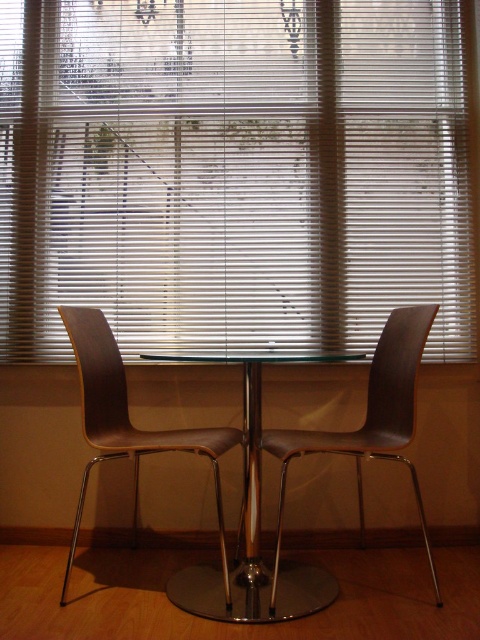
What do you see at coordinates (370, 419) in the screenshot? The width and height of the screenshot is (480, 640). I see `brown matte swivel chair at center` at bounding box center [370, 419].

What are the coordinates of `brown matte swivel chair at center` in the screenshot? It's located at (370, 419).

The width and height of the screenshot is (480, 640). I want to click on brown matte swivel chair at center, so click(370, 419).

Locate an element on the screen. This screenshot has height=640, width=480. brown matte swivel chair at center is located at coordinates (370, 419).

Is point (284, 262) positioned behind point (263, 600)?

That is True.

Identify the location of white matte blinds at center. (233, 173).

You are a GUI agent. You are given a task and a screenshot of the screen. Output one action in this format:
    pyautogui.click(x=<x>, y=<y>)
    Task: Click on the white matte blinds at center
    The height and width of the screenshot is (640, 480).
    Given the screenshot: What is the action you would take?
    pyautogui.click(x=233, y=173)

Can you confirm if white matte blinds at center is taller than matte wood swivel chair at left?

Yes.

Does white matte blinds at center have a lesser height compared to matte wood swivel chair at left?

No.

This screenshot has width=480, height=640. What are the coordinates of `white matte blinds at center` in the screenshot? It's located at (233, 173).